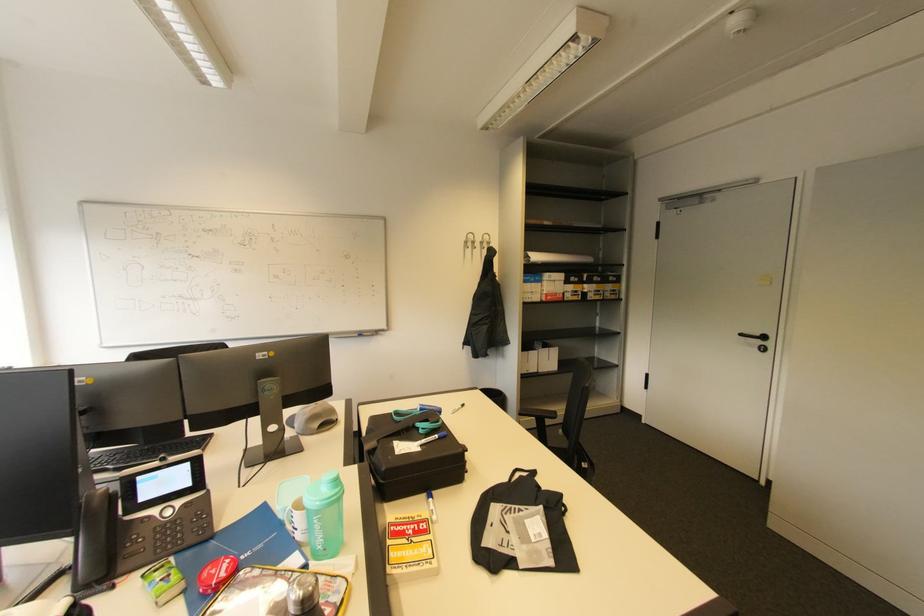
Where is `black door handle`? The image size is (924, 616). black door handle is located at coordinates coord(757,339).